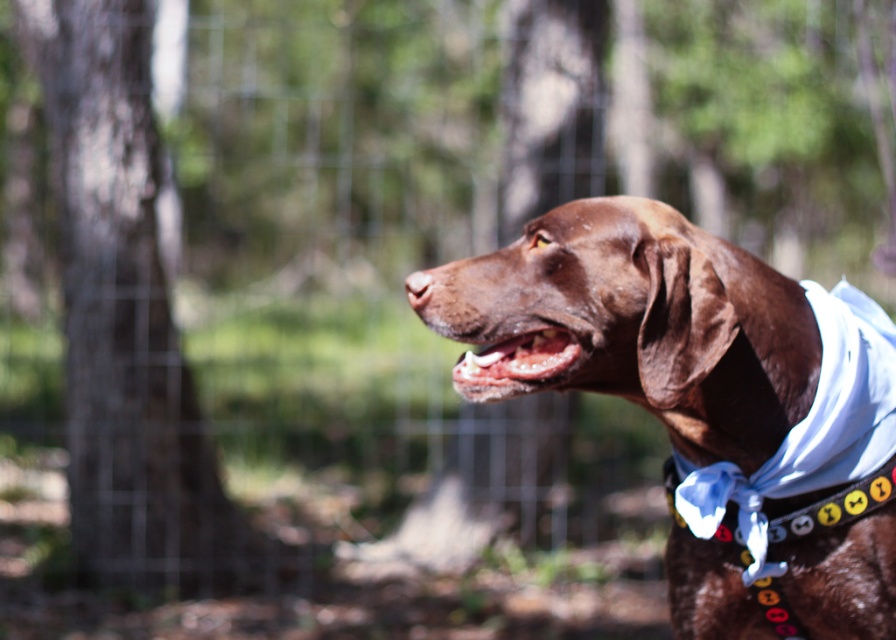
Is brown bark tree at left to the right of pink glossy teeth at center from the viewer's perspective?

Incorrect, brown bark tree at left is not on the right side of pink glossy teeth at center.

Which is behind, point (224, 493) or point (487, 380)?

The point (224, 493) is more distant.

The image size is (896, 640). I want to click on brown bark tree at left, so click(128, 324).

Is brown fur dog at center positioned behind brown bark tree at left?

No, brown fur dog at center is in front of brown bark tree at left.

Who is lower down, brown fur dog at center or brown bark tree at left?

brown fur dog at center

Measure the distance between brown fur dog at center and camera.

brown fur dog at center is 2.32 meters from camera.

Find the location of a particular element. This screenshot has height=640, width=896. brown fur dog at center is located at coordinates (643, 321).

In the scene shown: Is blue fabric neckband at right bigger than pink glossy teeth at center?

Indeed, blue fabric neckband at right has a larger size compared to pink glossy teeth at center.

Based on the photo, who is lower down, blue fabric neckband at right or pink glossy teeth at center?

blue fabric neckband at right

The image size is (896, 640). Describe the element at coordinates (808, 433) in the screenshot. I see `blue fabric neckband at right` at that location.

You are a GUI agent. You are given a task and a screenshot of the screen. Output one action in this format:
    pyautogui.click(x=<x>, y=<y>)
    Task: Click on the blue fabric neckband at right
    
    Given the screenshot: What is the action you would take?
    pyautogui.click(x=808, y=433)